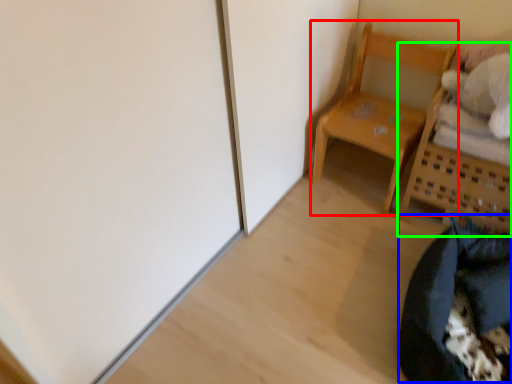
Question: Which object is the closest to the furniture (highlighted by a red box)? Choose among these: bean bag chair (highlighted by a blue box) or furniture (highlighted by a green box).

Choices:
 (A) bean bag chair
 (B) furniture

Answer: (B)